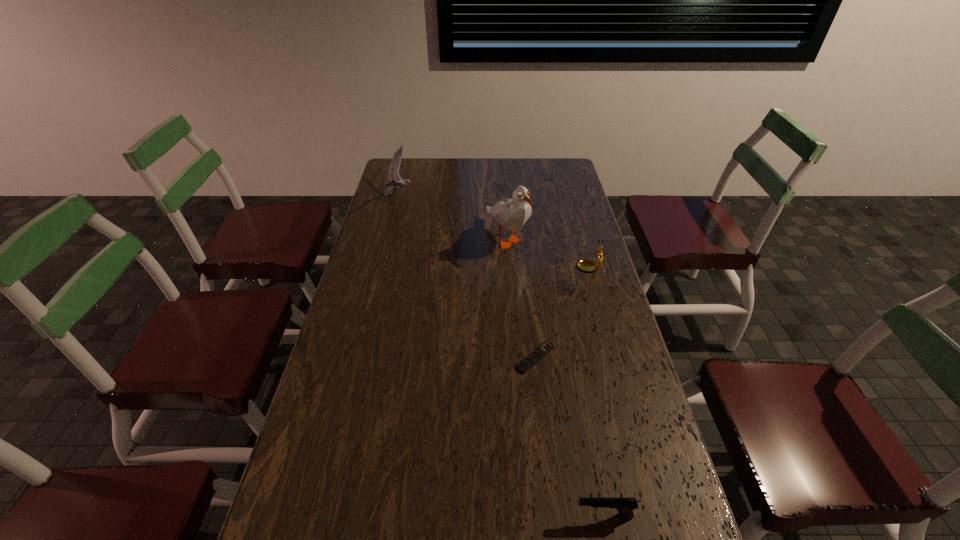
You are a GUI agent. You are given a task and a screenshot of the screen. Output one action in this format:
    pyautogui.click(x=<x>, y=<y>)
    Task: Click on the object at the left edge
    The height and width of the screenshot is (540, 960).
    Given the screenshot: What is the action you would take?
    pyautogui.click(x=396, y=182)

Image resolution: width=960 pixels, height=540 pixels. What are the coordinates of `pocket watch positioned at the right edge` in the screenshot? It's located at (587, 265).

Locate an element on the screen. The height and width of the screenshot is (540, 960). pistol located in the right edge section of the desktop is located at coordinates (625, 506).

Where is `object positioned at the far left corner`? Image resolution: width=960 pixels, height=540 pixels. object positioned at the far left corner is located at coordinates (396, 182).

Locate an element on the screen. vacant space at the far edge is located at coordinates (474, 173).

In the image, there is a desktop. Identify the location of vacant space at the left edge. This screenshot has width=960, height=540. (403, 233).

In the image, there is a desktop. What are the coordinates of `blank space at the right edge` in the screenshot? It's located at (592, 373).

The height and width of the screenshot is (540, 960). I want to click on free spot at the far left corner of the desktop, so click(x=402, y=171).

Identify the location of vacant space at the far right corner of the desktop. (556, 158).

Identify the location of free space between the fourth tallest object and the tallest object. The height and width of the screenshot is (540, 960). (555, 377).